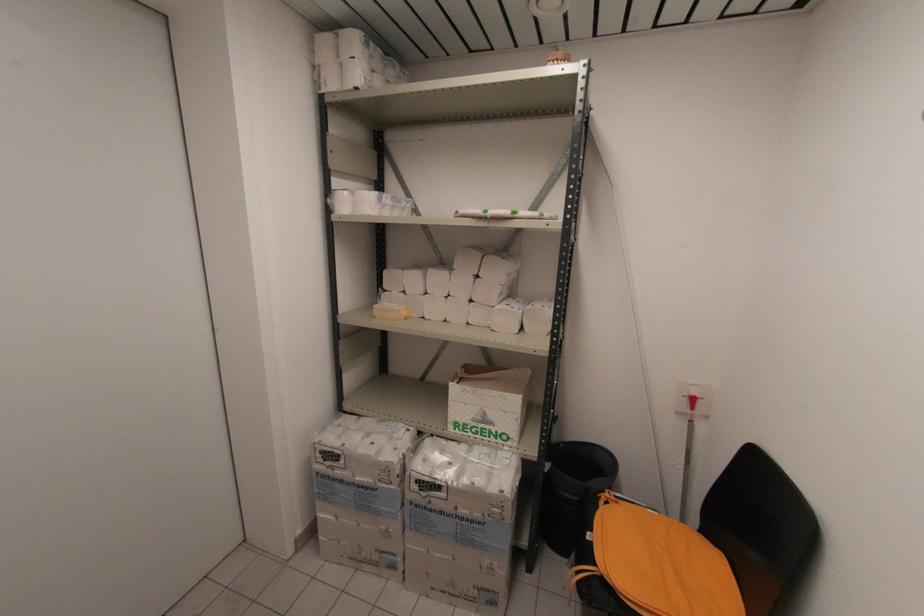
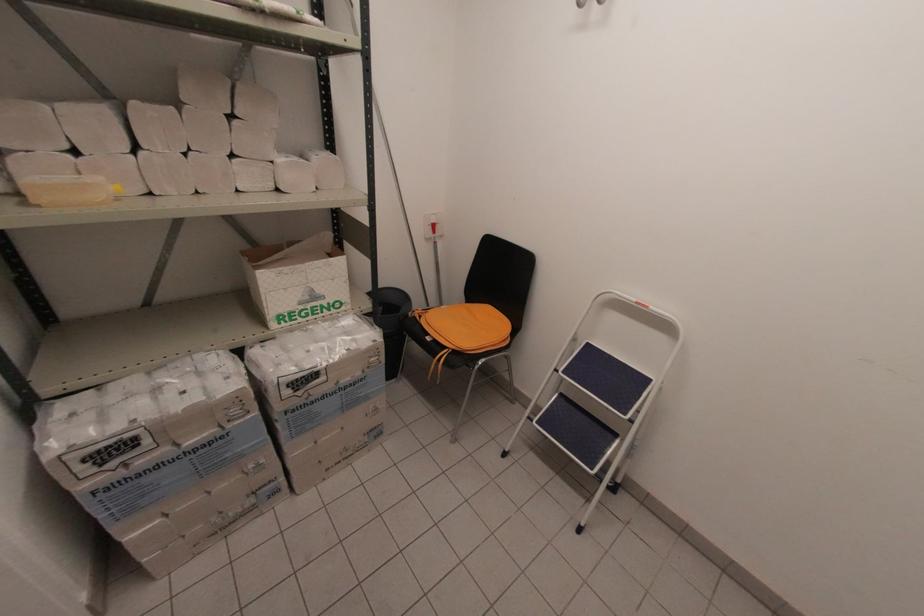
In the scene shown: How did the camera likely rotate?

The camera rotated toward right-down.